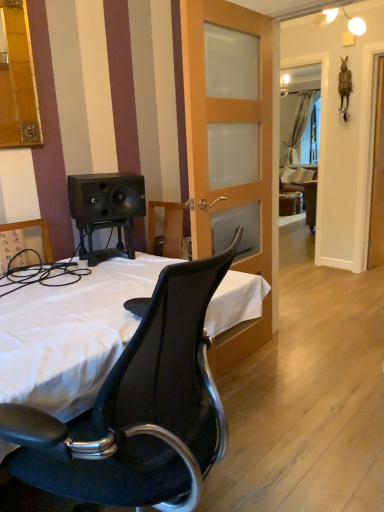
Question: In terms of size, does white fabric bed at center appear bigger or smaller than wooden frosted glass door at center?

Choices:
 (A) big
 (B) small

Answer: (A)

Question: Considering their positions, is white fabric bed at center located in front of or behind wooden frosted glass door at center?

Choices:
 (A) behind
 (B) front

Answer: (B)

Question: Estimate the real-world distances between objects in this image. Which object is closer to the clear glass screen door at right?

Choices:
 (A) wooden frosted glass door at center
 (B) white fabric bed at center
 (C) white sheer curtain at upper right

Answer: (A)

Question: Estimate the real-world distances between objects in this image. Which object is farther from the white sheer curtain at upper right?

Choices:
 (A) wooden frosted glass door at center
 (B) white fabric bed at center
 (C) clear glass screen door at right

Answer: (B)